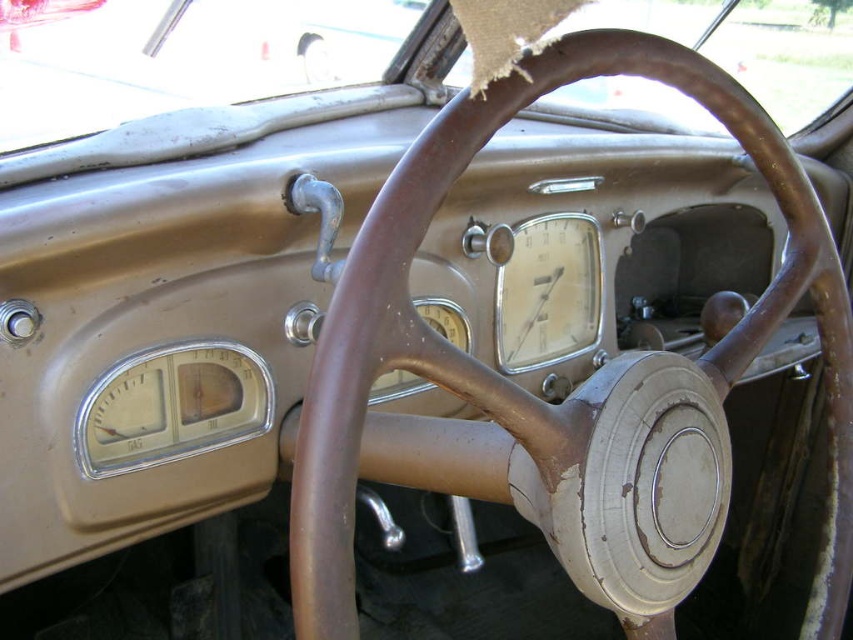
Question: Which object appears closest to the camera in this image?

Choices:
 (A) brown leather steering wheel at center
 (B) metallic silver speedometer at center

Answer: (B)

Question: Which point is farther to the camera?

Choices:
 (A) (323, 40)
 (B) (587, 218)

Answer: (A)

Question: Is metallic silver speedometer at center to the left of brown leather steering wheel at center from the viewer's perspective?

Choices:
 (A) no
 (B) yes

Answer: (A)

Question: Which object is closer to the camera taking this photo?

Choices:
 (A) metallic silver speedometer at center
 (B) brown leather steering wheel at center

Answer: (A)

Question: Is metallic silver speedometer at center positioned at the back of brown leather steering wheel at center?

Choices:
 (A) yes
 (B) no

Answer: (B)

Question: Is metallic silver speedometer at center closer to camera compared to brown leather steering wheel at center?

Choices:
 (A) no
 (B) yes

Answer: (B)